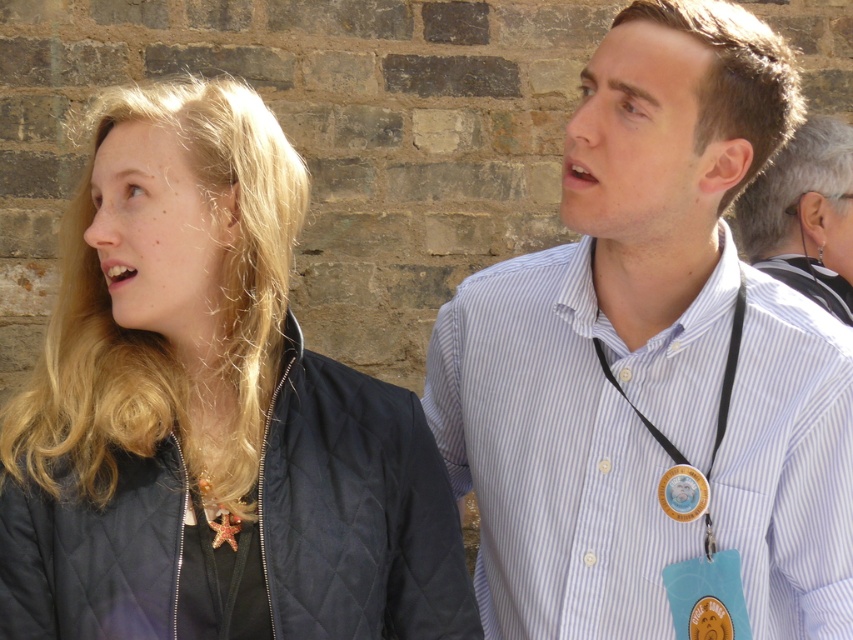
You are a photographer setting up for a group photo. You need to ensure that the quilted navy jacket at left and the white striped shirt at center are at least 20 inches apart to avoid overlapping in the photo. Based on the scene, will their current positions meet this requirement?

The distance between the quilted navy jacket at left and the white striped shirt at center is 19.94 inches, which is slightly less than the required 20 inches. Therefore, their current positions do not meet the requirement, and they need to move slightly further apart to avoid overlapping in the photo.

You are a photographer at a social event and need to capture both the white striped shirt at center and the white striped shirt at upper right in a single frame. Which of the two shirts should you focus on first to ensure both are in the frame?

The white striped shirt at center has a greater height compared to the white striped shirt at upper right, so you should focus on the white striped shirt at center first to ensure both are in the frame.

You are a photographer taking a portrait of the two people in the scene. You want to ensure both the white striped shirt at upper right and the gold metallic badge at center are clearly visible in the photo. Considering their sizes, which object might require you to adjust your camera focus more carefully to ensure it doesn not get lost in the background?

The gold metallic badge at center might require more careful focus adjustment since it is smaller in size compared to the white striped shirt at upper right, making it easier to become less distinct if not properly focused.